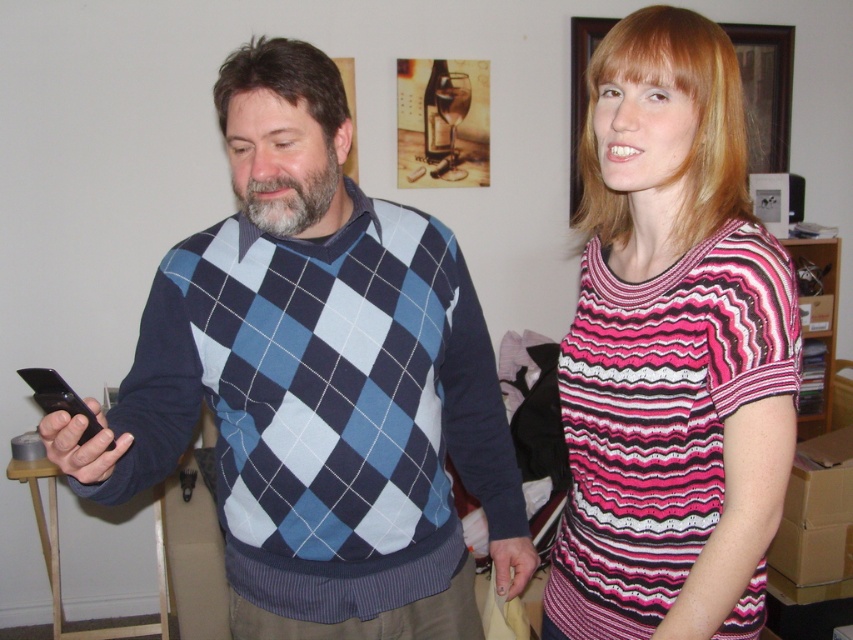
Who is more forward, (463, 332) or (627, 426)?

Point (627, 426)

Where is `blue argyle sweater at center`? The image size is (853, 640). blue argyle sweater at center is located at coordinates (317, 381).

Which is behind, point (341, 490) or point (646, 637)?

Point (341, 490)

The width and height of the screenshot is (853, 640). I want to click on blue argyle sweater at center, so click(317, 381).

In the scene shown: Does blue argyle sweater at center have a smaller size compared to black matte smartphone at left?

No, blue argyle sweater at center is not smaller than black matte smartphone at left.

Is point (215, 316) positioned behind point (44, 412)?

That is False.

Image resolution: width=853 pixels, height=640 pixels. I want to click on blue argyle sweater at center, so click(x=317, y=381).

Does pink striped sweater at right appear under black matte smartphone at left?

No, pink striped sweater at right is not below black matte smartphone at left.

Image resolution: width=853 pixels, height=640 pixels. In order to click on pink striped sweater at right in this screenshot , I will do `click(671, 352)`.

Where is `pink striped sweater at right`? This screenshot has width=853, height=640. pink striped sweater at right is located at coordinates pyautogui.click(x=671, y=352).